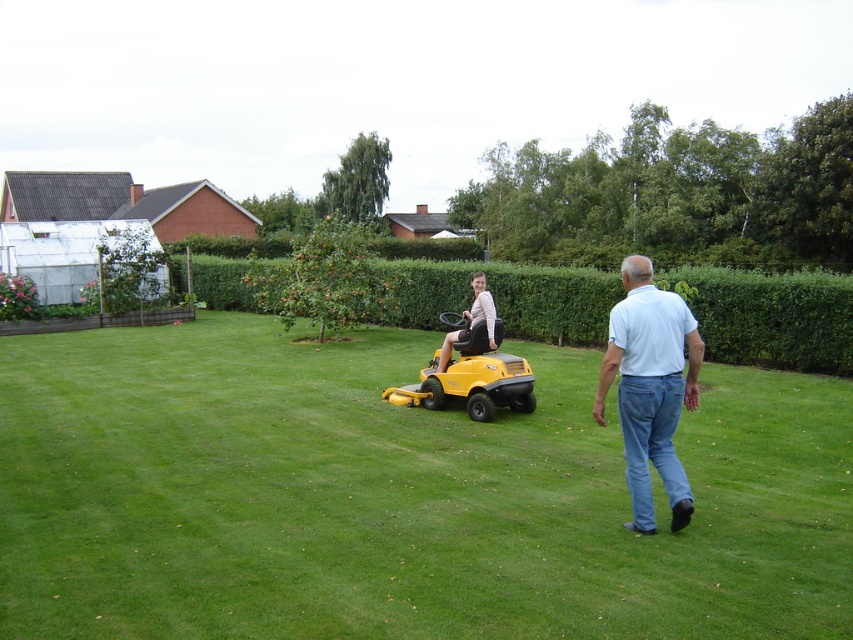
Based on the scene description, which object is taller between the green grass at center and the green hedge at center?

The green hedge at center is taller than the green grass at center.

You are a gardener planning to plant a row of flowers between the green grass at center and the green hedge at center. Which area should you choose to ensure the flowers have enough space to grow?

The green hedge at center is thicker than the green grass at center, so planting the flowers between them would require selecting the area near the green hedge at center to provide more space for growth.